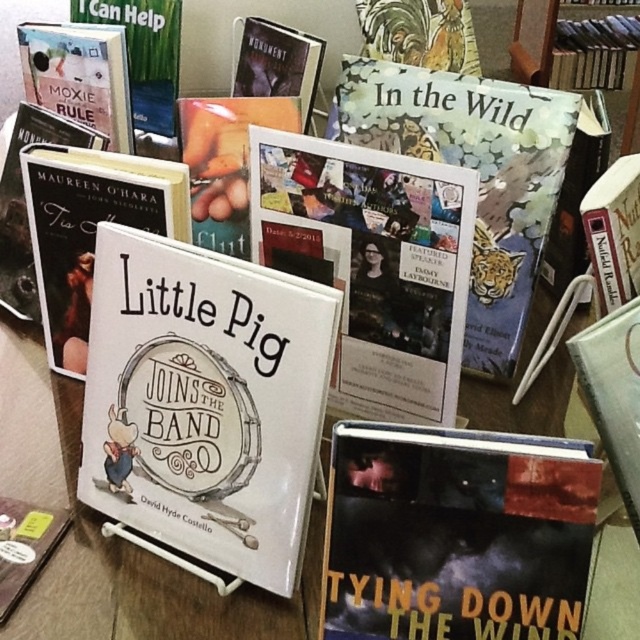
Image resolution: width=640 pixels, height=640 pixels. What do you see at coordinates (90, 228) in the screenshot?
I see `matte white book at center` at bounding box center [90, 228].

Which is in front, point (64, 166) or point (620, 440)?

Point (620, 440) is in front.

This screenshot has width=640, height=640. Identify the location of matte white book at center. (90, 228).

Describe the element at coordinates (456, 534) in the screenshot. I see `dark matte book at lower right` at that location.

Does point (401, 516) lie in front of point (625, 120)?

Yes, point (401, 516) is closer to viewer.

Locate an element on the screen. The height and width of the screenshot is (640, 640). dark matte book at lower right is located at coordinates (456, 534).

Is white paper flyer at center positioned in front of matte white book at center?

That is True.

Who is shorter, white paper flyer at center or matte white book at center?

matte white book at center

Is point (253, 170) closer to viewer compared to point (161, 172)?

No, (253, 170) is behind (161, 172).

This screenshot has height=640, width=640. I want to click on white paper flyer at center, so click(x=372, y=262).